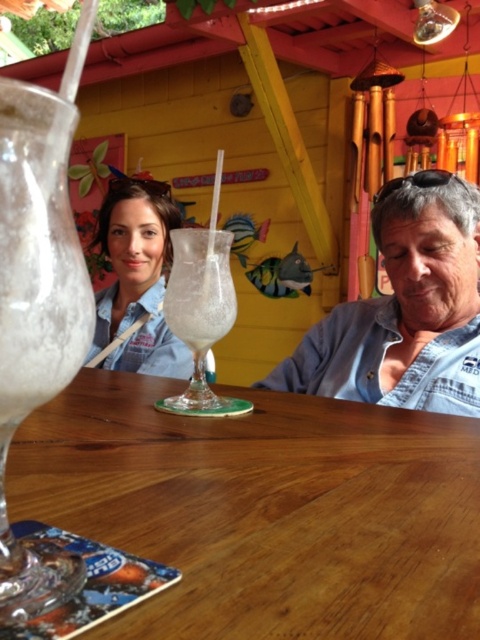
Question: Is clear glass cocktail at left smaller than white frosted glass at center?

Choices:
 (A) no
 (B) yes

Answer: (B)

Question: Which object appears closest to the camera in this image?

Choices:
 (A) denim shirt at right
 (B) matte blue shirt at upper left
 (C) wooden table at center
 (D) white frosted glass at center

Answer: (C)

Question: Does clear glass cocktail at left come in front of matte blue shirt at upper left?

Choices:
 (A) no
 (B) yes

Answer: (B)

Question: Which object is positioned farthest from the matte blue shirt at upper left?

Choices:
 (A) denim shirt at right
 (B) clear glass cocktail at left

Answer: (B)

Question: Is clear glass cocktail at left further to the viewer compared to white frosted glass at center?

Choices:
 (A) no
 (B) yes

Answer: (A)

Question: Estimate the real-world distances between objects in this image. Which object is closer to the wooden table at center?

Choices:
 (A) white frosted glass at center
 (B) denim shirt at right

Answer: (A)